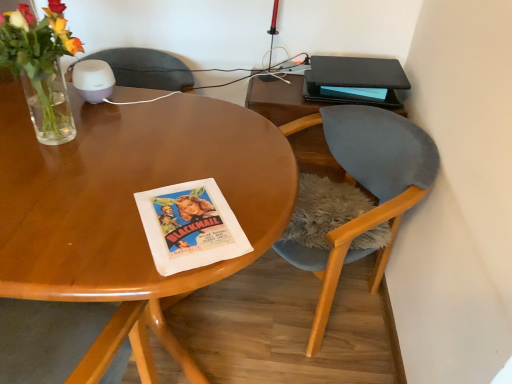
Question: Based on their sizes in the image, would you say black matte book at upper right is bigger or smaller than velvet grey chair at right?

Choices:
 (A) big
 (B) small

Answer: (B)

Question: From the image's perspective, is black matte book at upper right positioned above or below velvet grey chair at right?

Choices:
 (A) below
 (B) above

Answer: (B)

Question: In the image, is black matte book at upper right positioned in front of or behind velvet grey chair at right?

Choices:
 (A) behind
 (B) front

Answer: (A)

Question: In terms of width, does velvet grey chair at right look wider or thinner when compared to black matte book at upper right?

Choices:
 (A) thin
 (B) wide

Answer: (B)

Question: Is point coord(401,145) closer or farther from the camera than point coord(371,92)?

Choices:
 (A) closer
 (B) farther

Answer: (A)

Question: Is velvet grey chair at right spatially inside black matte book at upper right, or outside of it?

Choices:
 (A) outside
 (B) inside

Answer: (A)

Question: Based on their sizes in the image, would you say velvet grey chair at right is bigger or smaller than black matte book at upper right?

Choices:
 (A) small
 (B) big

Answer: (B)